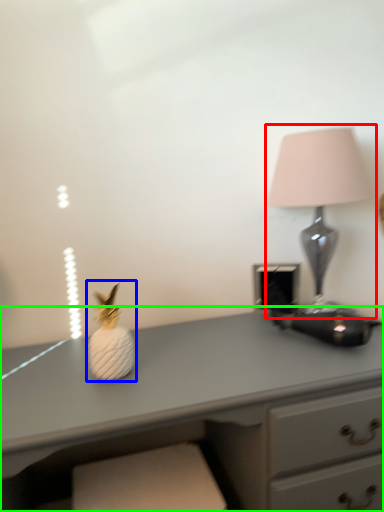
Question: Based on their relative distances, which object is farther from lamp (highlighted by a red box)? Choose from miniature (highlighted by a blue box) and desk (highlighted by a green box).

Choices:
 (A) miniature
 (B) desk

Answer: (A)